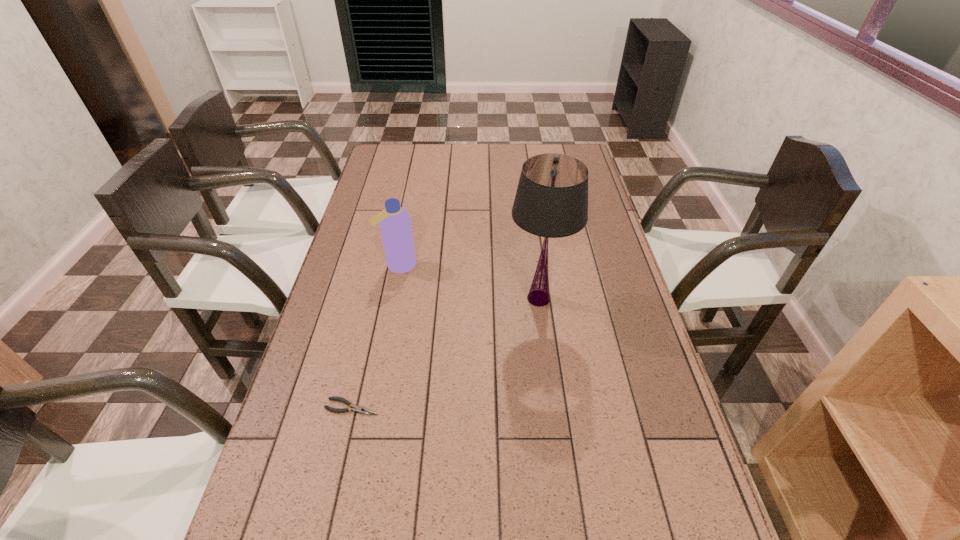
This screenshot has width=960, height=540. What are the coordinates of `lampshade` in the screenshot? It's located at (551, 201).

This screenshot has width=960, height=540. I want to click on the tallest object, so point(551,201).

Find the location of a particular element. the second shortest object is located at coordinates (395, 222).

Locate an element on the screen. shampoo is located at coordinates (395, 222).

Locate an element on the screen. The height and width of the screenshot is (540, 960). the nearest object is located at coordinates (362, 410).

I want to click on the shortest object, so click(362, 410).

Where is `free location located 0.120m on the front-facing side of the second nearest object`? This screenshot has height=540, width=960. free location located 0.120m on the front-facing side of the second nearest object is located at coordinates tap(466, 299).

At what (x,y) coordinates should I click in order to perform the action: click on free spot located 0.210m on the front-facing side of the second nearest object. Please return your answer as a coordinate pair (x, y). Looking at the image, I should click on (436, 299).

Where is `vacant point located on the front-facing side of the second nearest object`? Image resolution: width=960 pixels, height=540 pixels. vacant point located on the front-facing side of the second nearest object is located at coordinates click(x=463, y=299).

Where is `free point located on the right of the shampoo`? The width and height of the screenshot is (960, 540). free point located on the right of the shampoo is located at coordinates (489, 265).